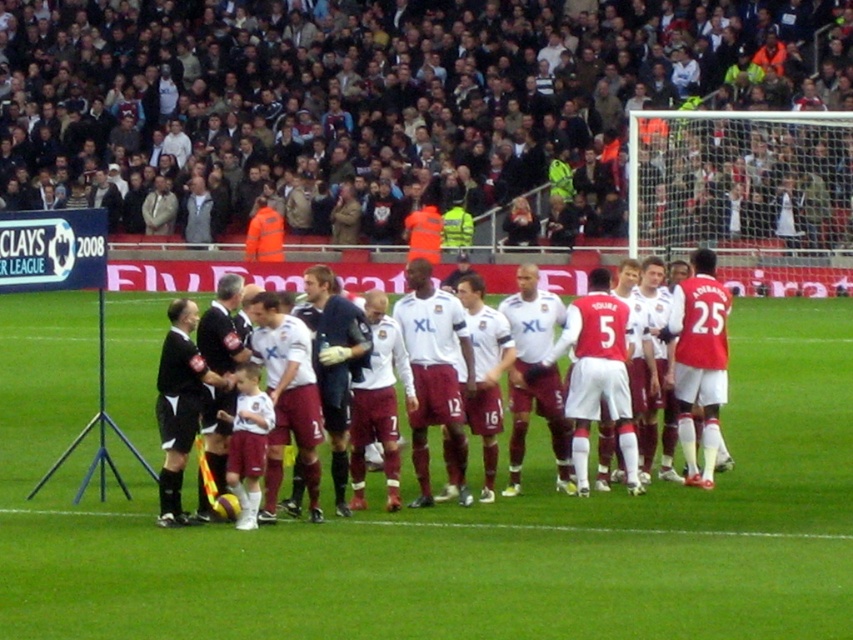
Is white smooth soccer field at center behind maroon jersey at center?

No, it is in front of maroon jersey at center.

Who is more forward, [601,636] or [430,276]?

Point [601,636] is more forward.

Identify the location of white smooth soccer field at center. This screenshot has height=640, width=853. (450, 522).

Can you confirm if white smooth soccer field at center is positioned to the right of black jersey at center?

Yes, white smooth soccer field at center is to the right of black jersey at center.

Who is more distant from viewer, [416,547] or [236,356]?

Positioned behind is point [236,356].

Identify the location of white smooth soccer field at center. The height and width of the screenshot is (640, 853). (450, 522).

Can you confirm if brown leather jacket at upper center is shorter than white matte jersey at center?

In fact, brown leather jacket at upper center may be taller than white matte jersey at center.

Who is shorter, brown leather jacket at upper center or white matte jersey at center?

With less height is white matte jersey at center.

Locate an element on the screen. This screenshot has height=640, width=853. brown leather jacket at upper center is located at coordinates (381, 104).

The image size is (853, 640). Find the location of `brown leather jacket at upper center`. brown leather jacket at upper center is located at coordinates point(381,104).